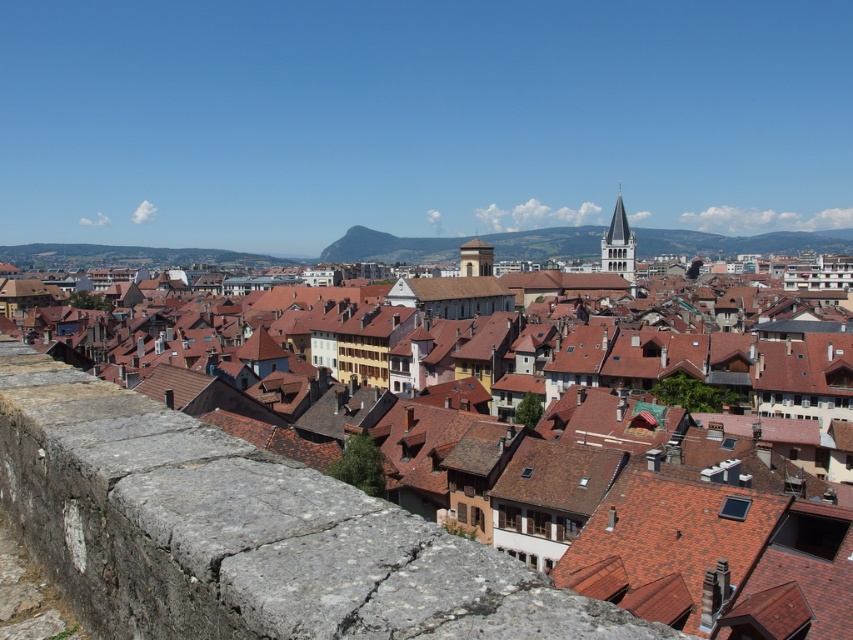
You are standing at the point marked as point (x=241, y=532) in the image. What structure are you currently on?

You are on the stone wall at lower left.

You are an architect designing a new pathway that must pass between the stone wall at lower left and the smooth white tower at upper center. The pathway requires a minimum width of 2 meters to accommodate foot traffic. Given the spatial constraints, can the pathway be constructed between these two structures?

The stone wall at lower left is narrower than the smooth white tower at upper center. However, the description only provides information about their widths relative to each other, not their absolute measurements. Without knowing the exact width of either structure, it is impossible to determine if the 2 meter pathway requirement can be met.